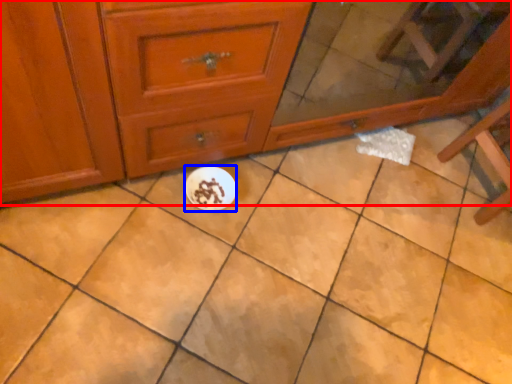
Question: Among these objects, which one is farthest to the camera, chest of drawers (highlighted by a red box) or paper plate (highlighted by a blue box)?

Choices:
 (A) chest of drawers
 (B) paper plate

Answer: (B)